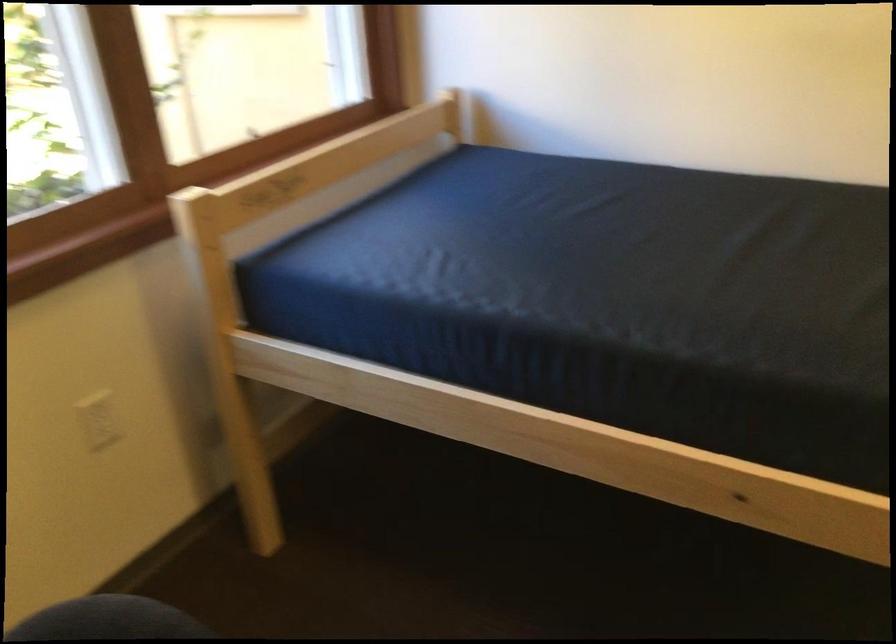
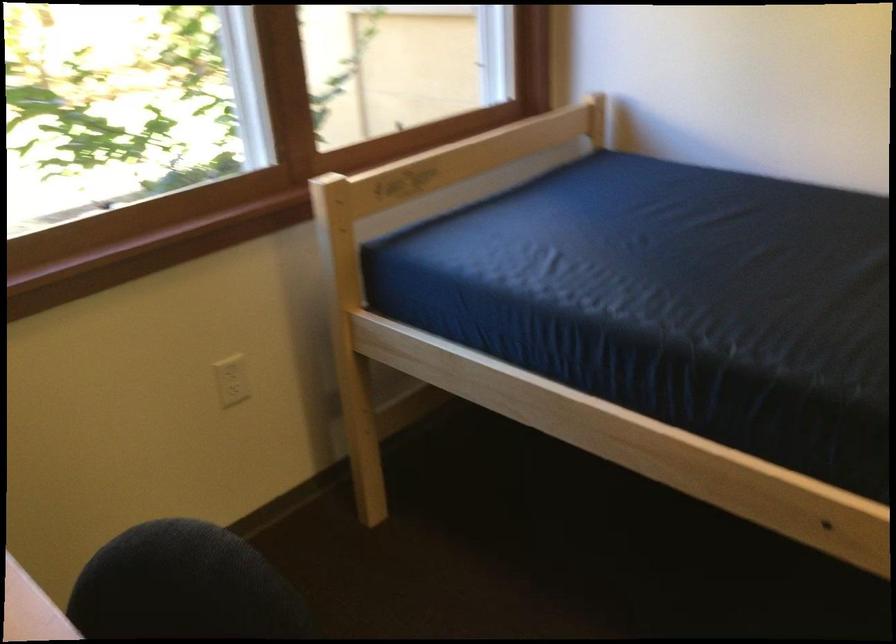
Question: The camera is either moving clockwise (left) or counter-clockwise (right) around the object. The first image is from the beginning of the video and the second image is from the end. Is the camera moving left or right when shooting the video?

Choices:
 (A) Left
 (B) Right

Answer: (B)